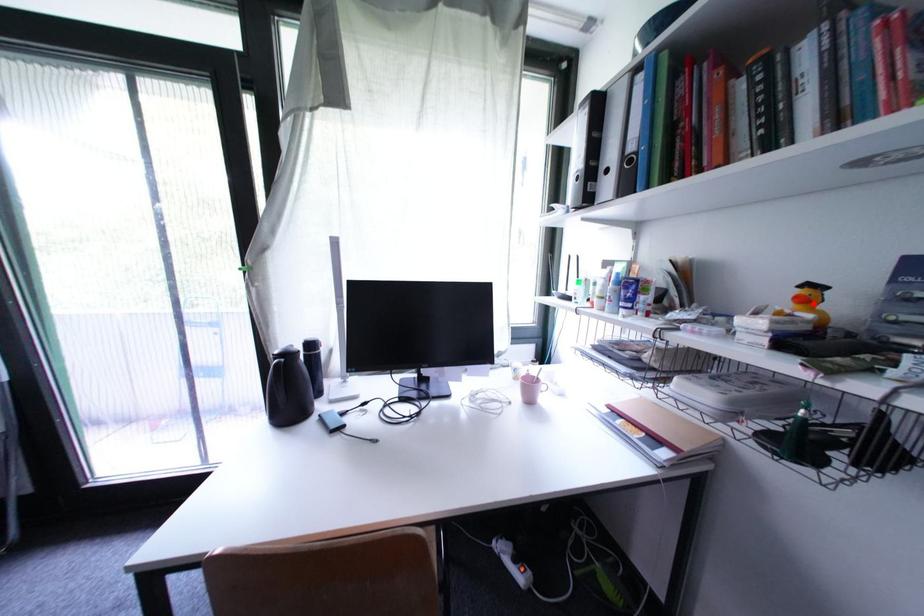
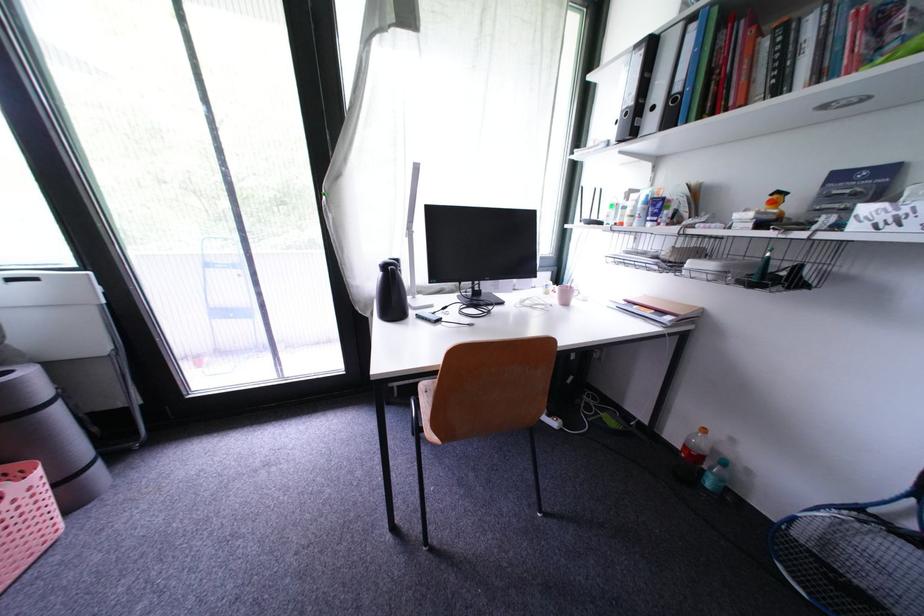
Where in the second image is the point corresponding to the highlighted location from the first image?

(782, 206)